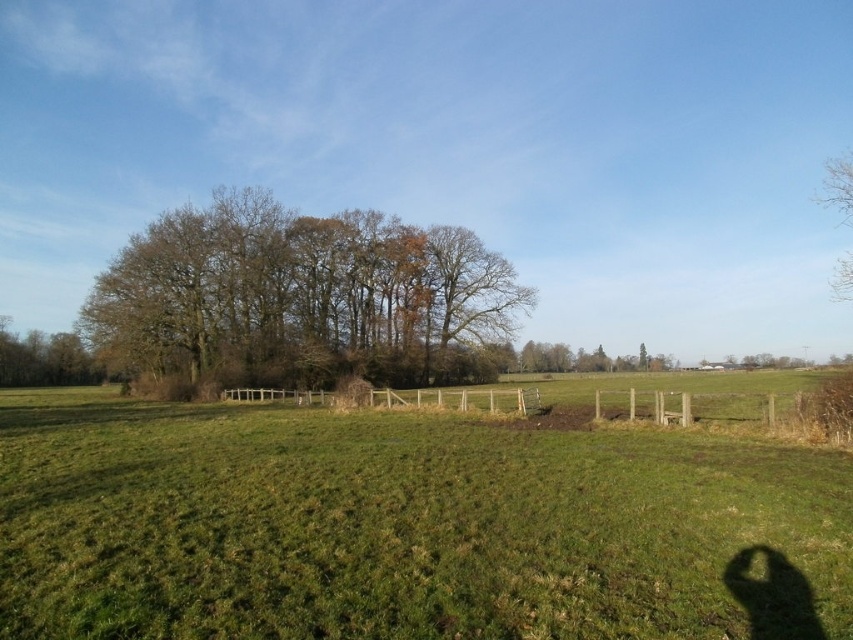
Question: Based on their relative distances, which object is farther from the green grassy field at center?

Choices:
 (A) bare branches at upper right
 (B) brown textured tree at left

Answer: (B)

Question: Does green grassy field at center appear under brown textured tree at left?

Choices:
 (A) yes
 (B) no

Answer: (A)

Question: Does green grassy field at center lie in front of bare branches at upper right?

Choices:
 (A) no
 (B) yes

Answer: (B)

Question: Where is green grassy field at center located in relation to bare branches at upper right in the image?

Choices:
 (A) above
 (B) below

Answer: (B)

Question: Which point is closer to the camera?

Choices:
 (A) brown leafy tree at center
 (B) bare branches at upper right

Answer: (B)

Question: Considering the real-world distances, which object is farthest from the bare branches at upper right?

Choices:
 (A) brown leafy tree at center
 (B) brown textured tree at left
 (C) green grassy field at center

Answer: (B)